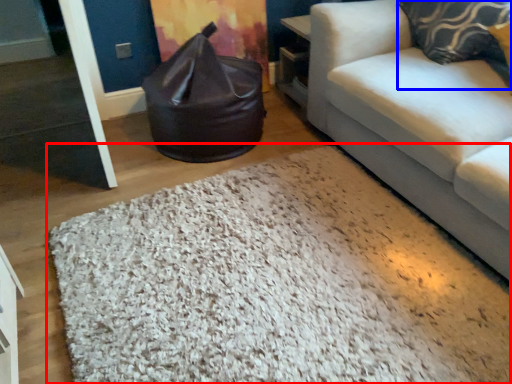
Question: Which point is closer to the camera, mat (highlighted by a red box) or pillow (highlighted by a blue box)?

Choices:
 (A) mat
 (B) pillow

Answer: (A)